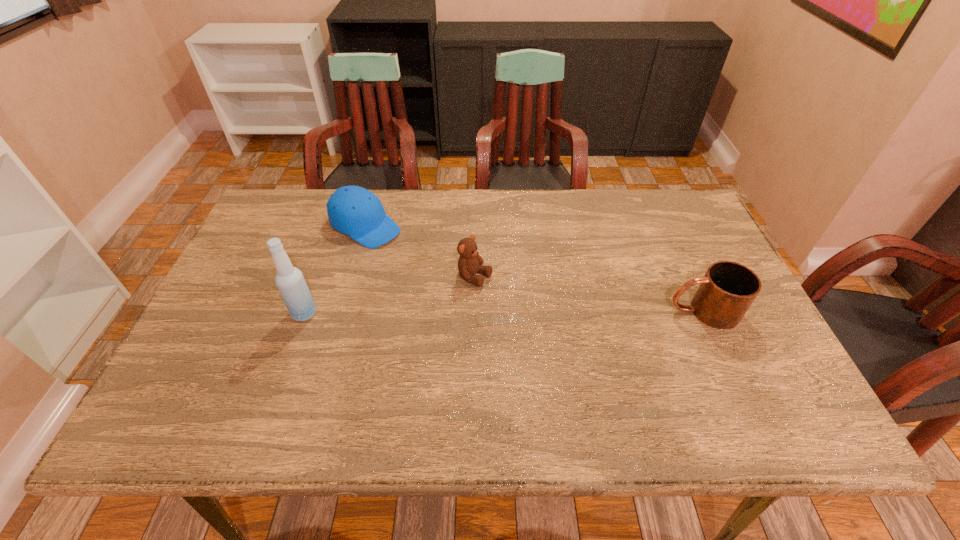
You are a GUI agent. You are given a task and a screenshot of the screen. Output one action in this format:
    pyautogui.click(x=<x>, y=<y>)
    Task: Click on the free space between the farthest object and the third nearest object
    
    Given the screenshot: What is the action you would take?
    pyautogui.click(x=420, y=252)

This screenshot has width=960, height=540. Find the location of `free spot between the farthest object and the mug`. free spot between the farthest object and the mug is located at coordinates (534, 268).

Identify which object is the third closest to the cap. Please provide its 2D coordinates. Your answer should be formatted as a tuple, i.e. [(x, y)], where the tuple contains the x and y coordinates of a point satisfying the conditions above.

[(727, 290)]

At what (x,y) coordinates should I click in order to perform the action: click on object that stands as the third closest to the farthest object. Please return your answer as a coordinate pair (x, y). This screenshot has height=540, width=960. Looking at the image, I should click on (727, 290).

In order to click on vacant area that satisfies the following two spatial constraints: 1. on the front side of the farthest object; 2. on the side of the mug with the handle in this screenshot , I will do `click(342, 311)`.

Locate an element on the screen. Image resolution: width=960 pixels, height=540 pixels. free location that satisfies the following two spatial constraints: 1. on the back side of the bottle; 2. on the side of the rightmost object with the handle is located at coordinates (305, 311).

At what (x,y) coordinates should I click in order to perform the action: click on vacant area that satisfies the following two spatial constraints: 1. on the back side of the rightmost object; 2. on the side of the tallest object with the handle. Please return your answer as a coordinate pair (x, y). This screenshot has height=540, width=960. Looking at the image, I should click on (305, 311).

Identify the location of free space that satisfies the following two spatial constraints: 1. on the back side of the bottle; 2. on the left side of the farthest object. point(335,226).

Identify the location of vacant space that satisfies the following two spatial constraints: 1. on the front side of the mug; 2. on the side of the farthest object with the handle. (342, 311).

Identify the location of free point that satisfies the following two spatial constraints: 1. on the front side of the cap; 2. on the side of the mug with the handle. The image size is (960, 540). (342, 311).